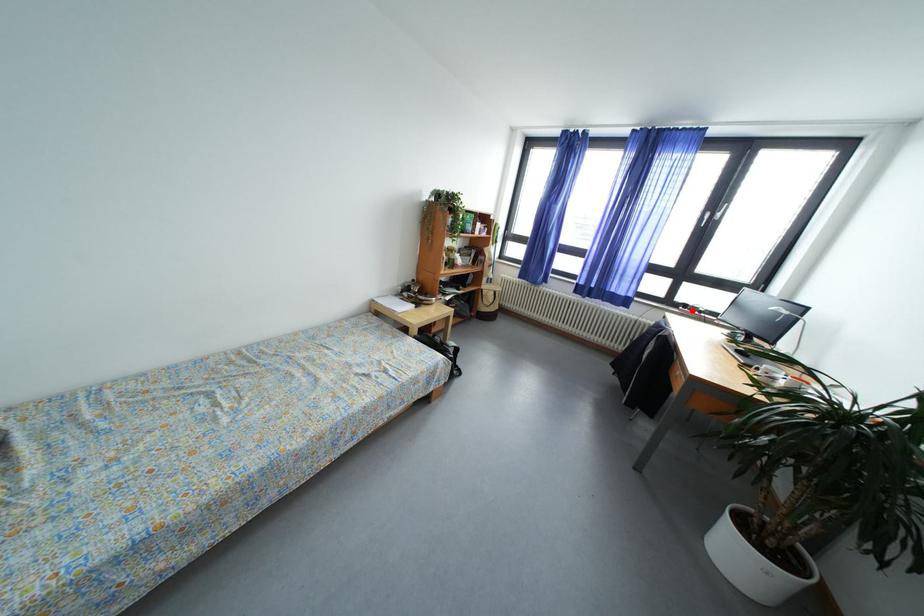
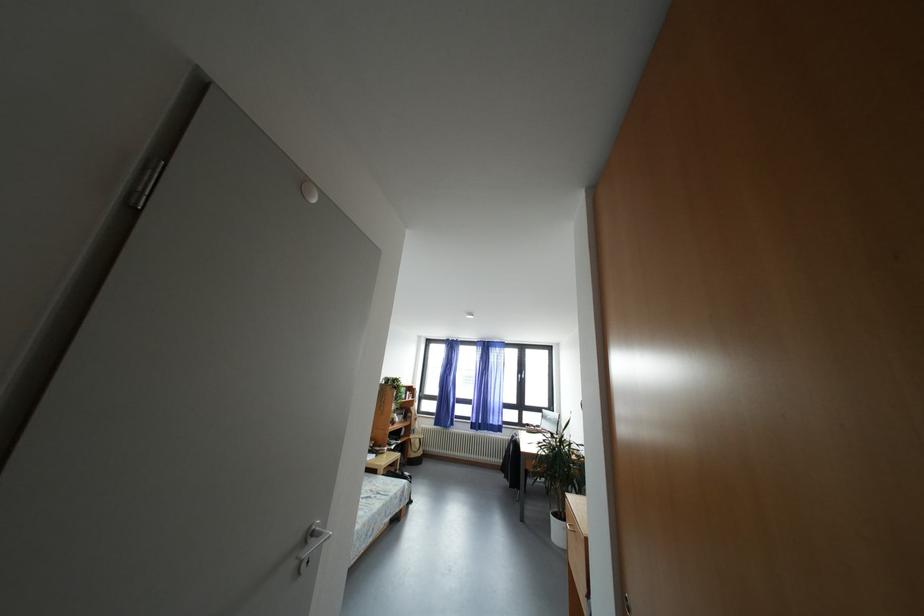
Question: I am providing you with two images of the same scene from different viewpoints. A red point is shown in image1. For the corresponding object point in image2, is it positioned nearer or farther from the camera?

Choices:
 (A) Nearer
 (B) Farther

Answer: (B)